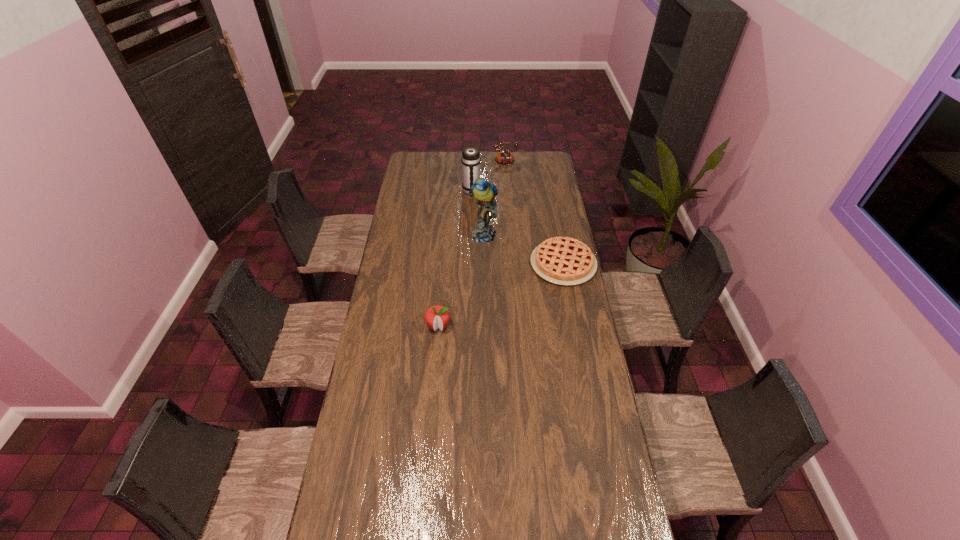
In order to click on vacant space on the desktop that is between the apple and the shortest object and is positioned on the side with the handle of the fourth nearest object in this screenshot , I will do `click(510, 291)`.

You are a GUI agent. You are given a task and a screenshot of the screen. Output one action in this format:
    pyautogui.click(x=<x>, y=<y>)
    Task: Click on the vacant space on the desktop that is between the leftmost object and the shortest object and is positioned on the face of the parrot
    The width and height of the screenshot is (960, 540).
    Given the screenshot: What is the action you would take?
    pos(492,300)

Identify the location of vacant space on the desktop that is between the apple and the shortest object and is positioned on the rotary dial of the telephone. This screenshot has height=540, width=960. (518, 286).